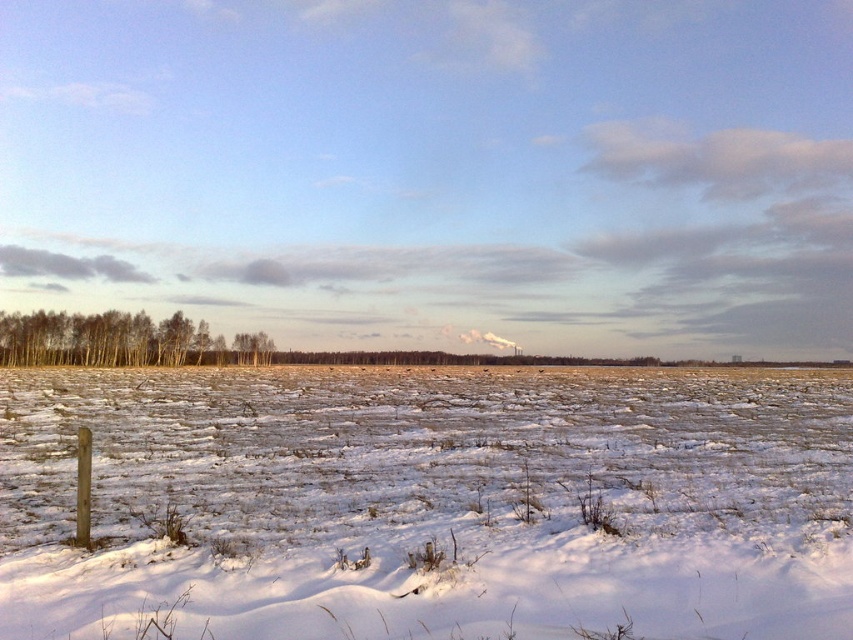
Does white powdery snow at lower left appear on the left side of brown smooth trees at left?

No, white powdery snow at lower left is not to the left of brown smooth trees at left.

Between point (155, 372) and point (62, 326), which one is positioned behind?

The point (62, 326) is more distant.

The height and width of the screenshot is (640, 853). In order to click on white powdery snow at lower left in this screenshot , I will do `click(428, 500)`.